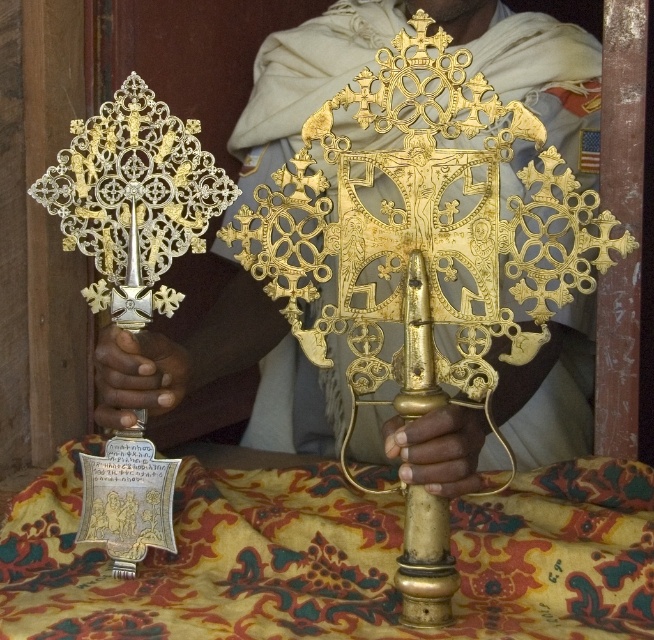
You are standing 1 meter away from the camera. Can you reach the point at coordinates point (313,412) if you can extend your arm 1.5 meters?

The point at coordinates point (313,412) is 1.39 meters away from the camera. Since you are 1 meter away from the camera, the total distance between you and the point is 2.39 meters. Your arm can only extend 1.5 meters, so you cannot reach the point at coordinates point (313,412).